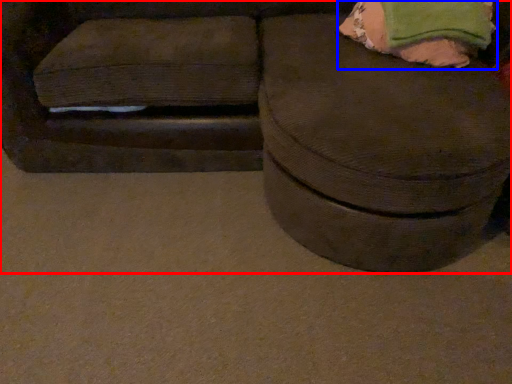
Question: Which object appears closest to the camera in this image, furniture (highlighted by a red box) or bean bag chair (highlighted by a blue box)?

Choices:
 (A) furniture
 (B) bean bag chair

Answer: (A)